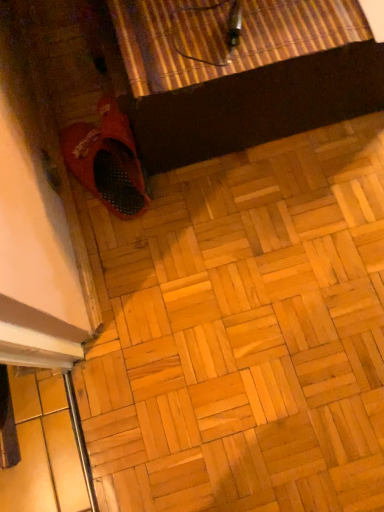
Question: Is matte black cat litter box at lower left at the back of matte red shoe at lower left?

Choices:
 (A) yes
 (B) no

Answer: (B)

Question: Considering the relative sizes of matte red shoe at lower left and matte black cat litter box at lower left in the image provided, is matte red shoe at lower left shorter than matte black cat litter box at lower left?

Choices:
 (A) no
 (B) yes

Answer: (A)

Question: Would you say matte red shoe at lower left contains matte black cat litter box at lower left?

Choices:
 (A) yes
 (B) no

Answer: (B)

Question: Is matte red shoe at lower left thinner than matte black cat litter box at lower left?

Choices:
 (A) no
 (B) yes

Answer: (B)

Question: From the image's perspective, would you say matte red shoe at lower left is shown under matte black cat litter box at lower left?

Choices:
 (A) yes
 (B) no

Answer: (B)

Question: Does matte red shoe at lower left have a greater height compared to matte black cat litter box at lower left?

Choices:
 (A) yes
 (B) no

Answer: (A)

Question: Is matte black cat litter box at lower left to the right of matte red shoe at lower left from the viewer's perspective?

Choices:
 (A) yes
 (B) no

Answer: (A)

Question: Is matte black cat litter box at lower left looking in the opposite direction of matte red shoe at lower left?

Choices:
 (A) no
 (B) yes

Answer: (A)

Question: Are matte black cat litter box at lower left and matte red shoe at lower left making contact?

Choices:
 (A) yes
 (B) no

Answer: (B)

Question: From the image's perspective, would you say matte black cat litter box at lower left is positioned over matte red shoe at lower left?

Choices:
 (A) yes
 (B) no

Answer: (B)

Question: Can you confirm if matte black cat litter box at lower left is taller than matte red shoe at lower left?

Choices:
 (A) yes
 (B) no

Answer: (B)

Question: Does matte black cat litter box at lower left come in front of matte red shoe at lower left?

Choices:
 (A) yes
 (B) no

Answer: (A)

Question: From a real-world perspective, is matte black cat litter box at lower left above or below matte red shoe at lower left?

Choices:
 (A) above
 (B) below

Answer: (B)